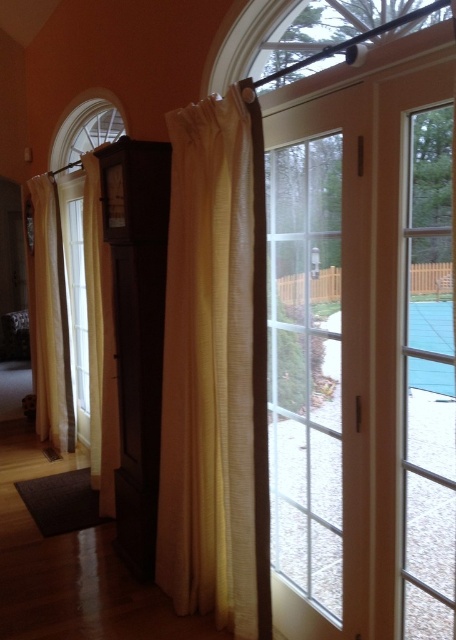
Can you confirm if light beige sheer curtain at left is taller than beige textured curtain at left?

Yes, light beige sheer curtain at left is taller than beige textured curtain at left.

Between light beige sheer curtain at left and beige textured curtain at left, which one is positioned lower?

beige textured curtain at left

This screenshot has height=640, width=456. Find the location of `light beige sheer curtain at left`. light beige sheer curtain at left is located at coordinates (51, 321).

Which of these two, clear glass door at right or light beige sheer curtain at left, stands taller?

Standing taller between the two is light beige sheer curtain at left.

The width and height of the screenshot is (456, 640). What do you see at coordinates (429, 385) in the screenshot?
I see `clear glass door at right` at bounding box center [429, 385].

Identify the location of clear glass door at right. This screenshot has height=640, width=456. (429, 385).

Does clear glass door at right appear under beige textured curtain at left?

Yes, clear glass door at right is below beige textured curtain at left.

Does clear glass door at right come behind beige textured curtain at left?

No.

This screenshot has height=640, width=456. In order to click on clear glass door at right in this screenshot , I will do `click(429, 385)`.